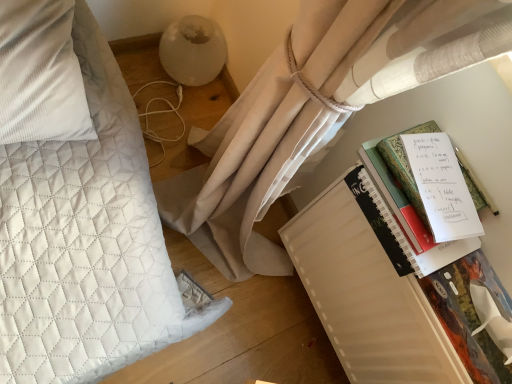
The width and height of the screenshot is (512, 384). I want to click on empty space that is ontop of white paper notebook at right (from a real-world perspective), so click(438, 185).